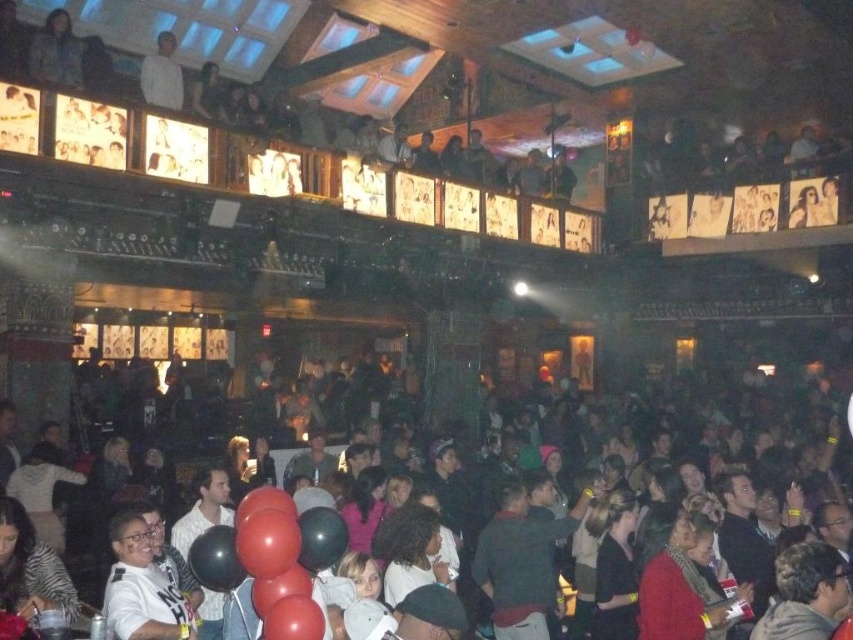
You are standing in the nightclub and want to take a photo of both points. Which point, point (453, 509) or point (178, 104), will appear larger in your camera view?

Point (453, 509) will appear larger in your camera view because it is closer to the camera than point (178, 104).

You are a photographer trying to capture a clear shot of the black glossy balloons at lower center without the white matte shirt at upper left blocking the view. Based on their positions, is this possible?

Yes, since the black glossy balloons at lower center are positioned below the white matte shirt at upper left, you can angle your camera downward to capture the balloons without the shirt obstructing the view.